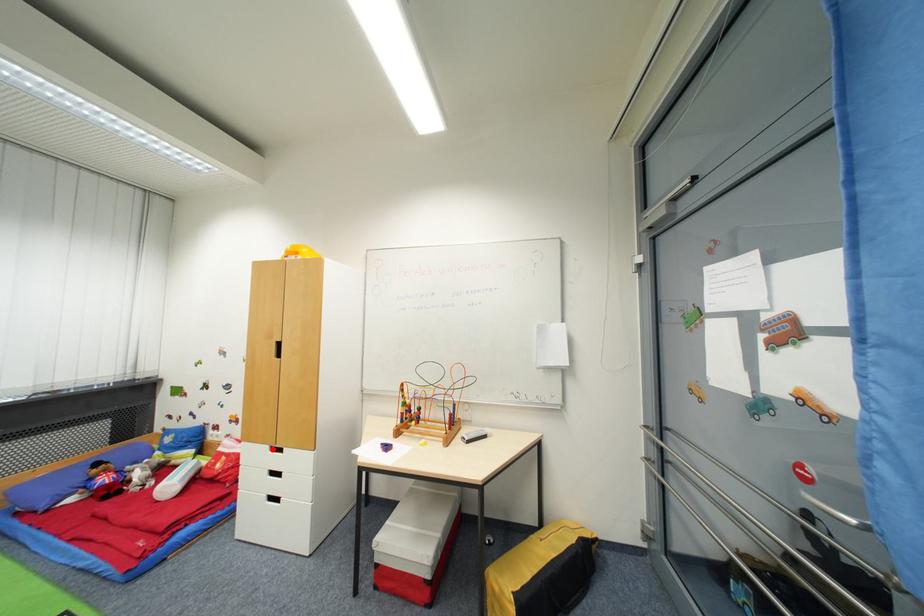
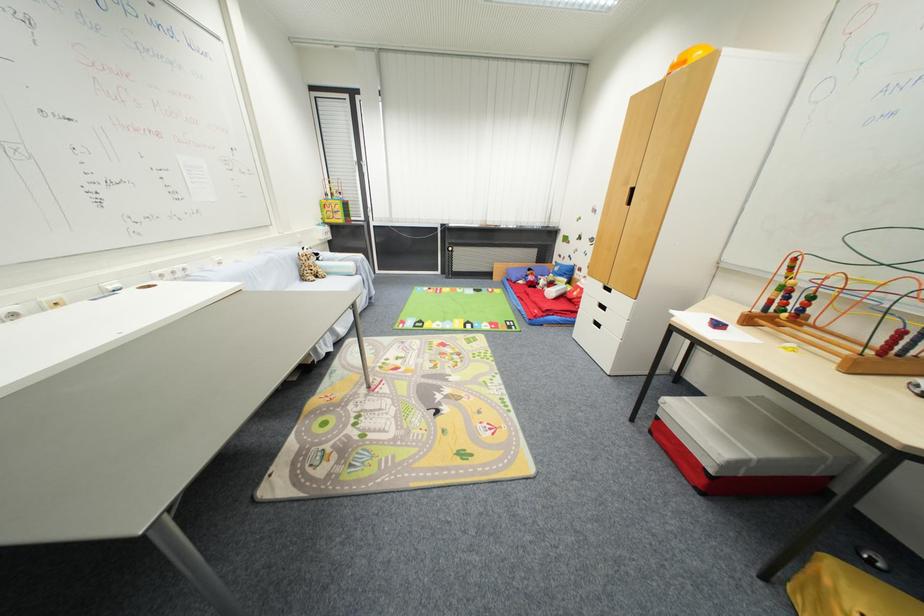
Question: I am providing you with two images of the same scene from different viewpoints. Image1 has a red point marked. In image2, the corresponding 3D location appears at what relative position? Reply with the corresponding letter.

Choices:
 (A) Closer
 (B) Farther

Answer: (A)